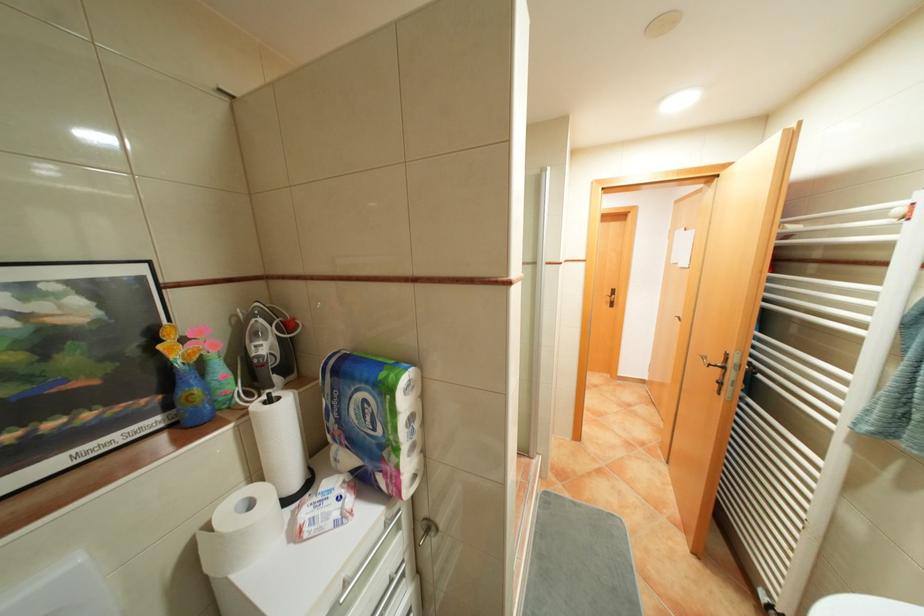
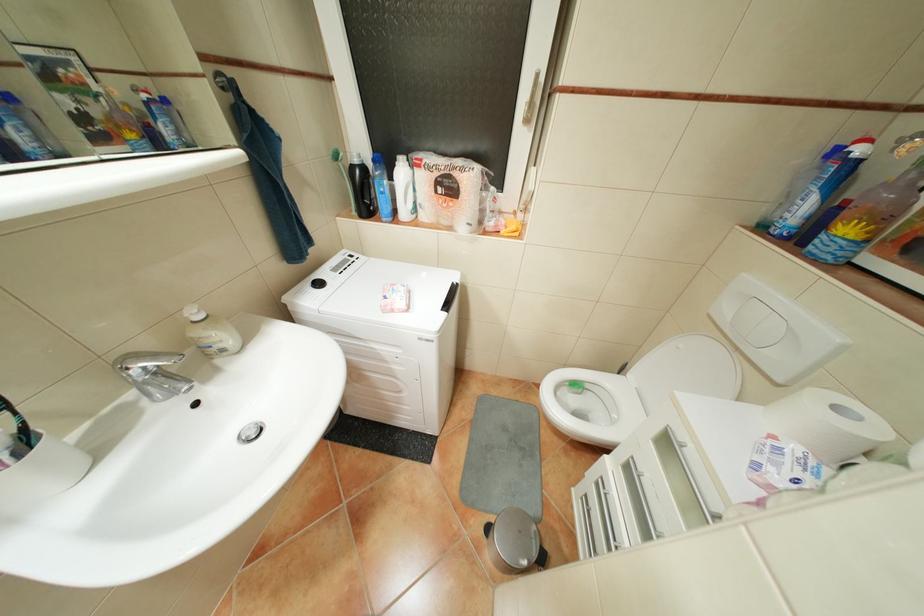
Locate, in the second image, the point that corresponds to the point at 330,496 in the first image.

(821, 463)